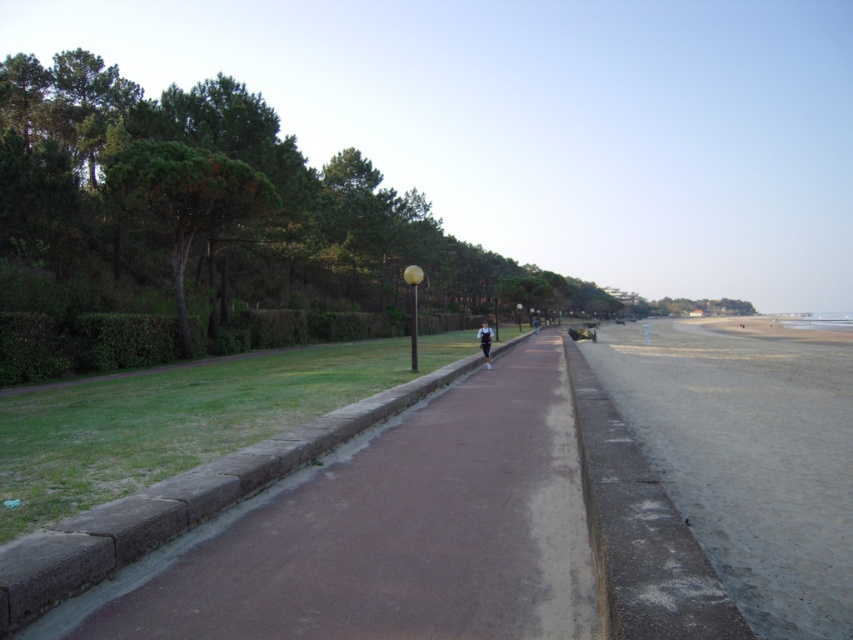
You are standing on the paved pathway in the coastal scene. You notice two points marked on the image. The first point is at coordinate [785,376], and the second is at [132,506]. If you are facing the direction of the beach, which point is closer to your front?

Point [132,506] is closer to your front because it is in front of point [785,376] when facing the beach direction.

You are a pedestrian walking along the coastal path and notice both the gray concrete curb at center and the light blue fabric jacket at center. Which object appears larger in size?

The light blue fabric jacket at center appears larger than the gray concrete curb at center.

You are a pedestrian walking along the paved pathway in the coastal scene. You notice a gray concrete curb at center and a light blue fabric jacket at center. Which object is closer to you as you walk along the path?

The gray concrete curb at center is closer to you because it is positioned in front of the light blue fabric jacket at center along your line of sight.